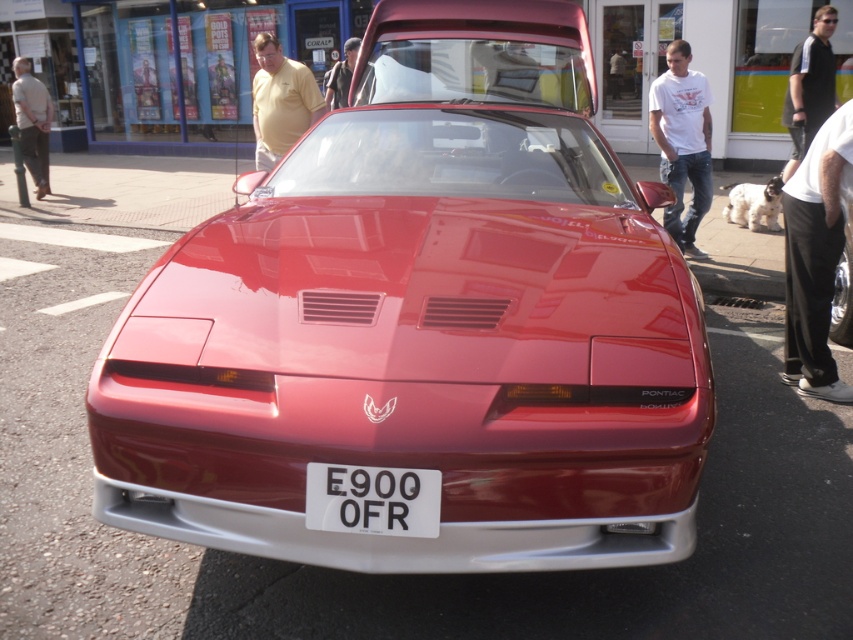
Between white plastic license plate at center and yellow shirt at center, which one appears on the right side from the viewer's perspective?

white plastic license plate at center is more to the right.

Between point (366, 486) and point (346, 84), which one is positioned in front?

Point (366, 486) is more forward.

Which is behind, point (437, 488) or point (347, 90)?

Positioned behind is point (347, 90).

The image size is (853, 640). Identify the location of white plastic license plate at center. (372, 499).

Is shiny red car at center positioned at the back of yellow shirt at center?

No, it is in front of yellow shirt at center.

Identify the location of shiny red car at center. The image size is (853, 640). (422, 323).

Is black jersey at upper right above light beige shirt at left?

Actually, black jersey at upper right is below light beige shirt at left.

Is black jersey at upper right further to camera compared to light beige shirt at left?

No, black jersey at upper right is closer to the viewer.

The height and width of the screenshot is (640, 853). In order to click on black jersey at upper right in this screenshot , I will do `click(809, 86)`.